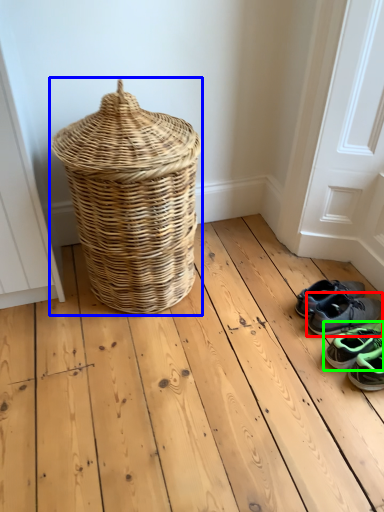
Question: Estimate the real-world distances between objects in this image. Which object is closer to footwear (highlighted by a red box), picnic basket (highlighted by a blue box) or footwear (highlighted by a green box)?

Choices:
 (A) picnic basket
 (B) footwear

Answer: (B)